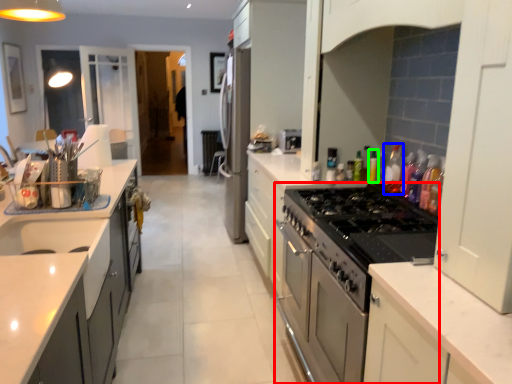
Question: Which object is positioned closest to appliance (highlighted by a red box)? Select from bottle (highlighted by a blue box) and bottle (highlighted by a green box).

Choices:
 (A) bottle
 (B) bottle

Answer: (A)